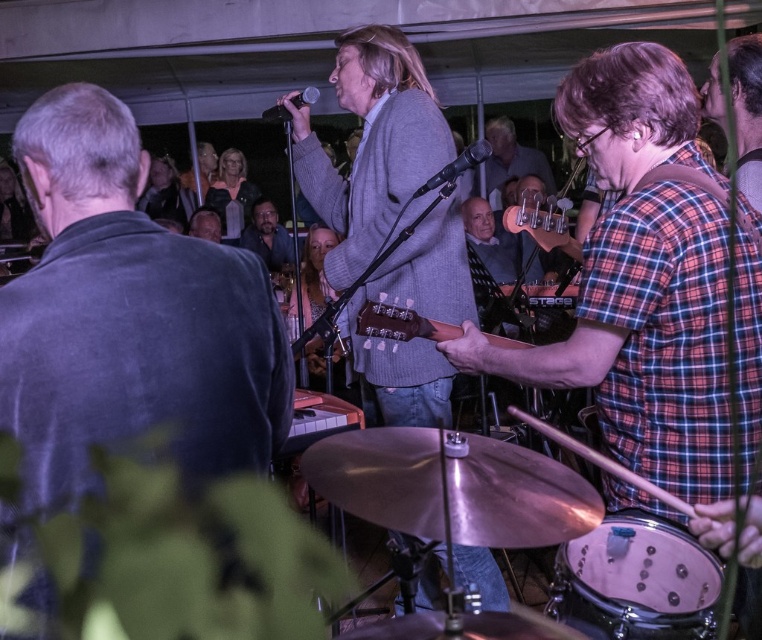
Consider the image. You are a photographer standing at the back of the tent. You want to take a photo of the light brown wooden guitar at center and the drummer in the foreground. Can you fit both in your camera frame if your camera has a 1.5 meter field of view?

The light brown wooden guitar at center and the drummer in the foreground are 1.57 meters apart. Since the camera has a 1.5 meter field of view, which is slightly shorter than the distance between them, you might need to adjust your position to ensure both fit within the frame.

In the scene shown: You are standing at the center of the stage and want to move towards the audience. There are two points marked on the stage floor, point 1 at coordinates point (389,333) and point 2 at coordinates point (492,144). Which point should you step on to get closer to the audience?

Point 1 at coordinates point (389,333) is in front of point 2 at coordinates point (492,144), so stepping on point 1 at coordinates point (389,333) would bring you closer to the audience.